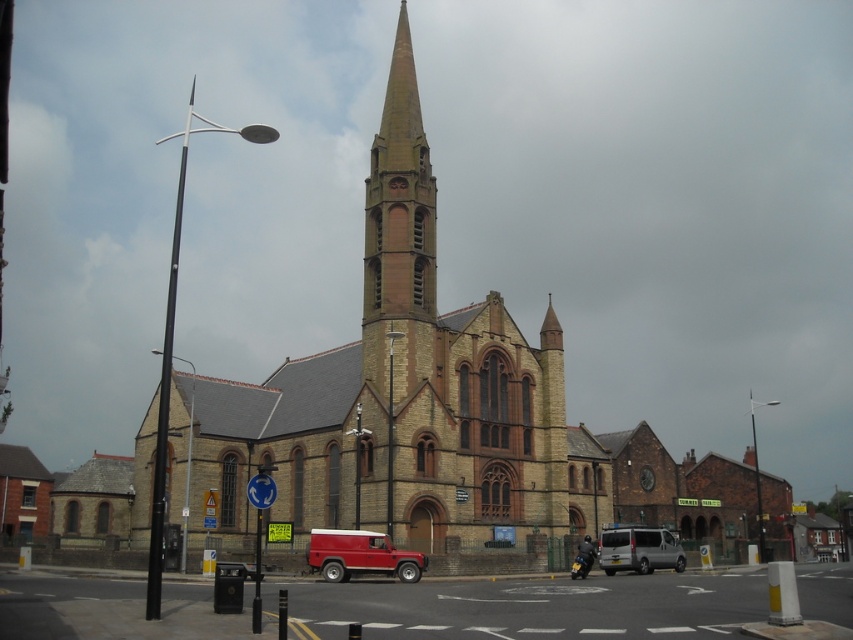
Question: Is brick church at center to the right of silver metallic van at center from the viewer's perspective?

Choices:
 (A) no
 (B) yes

Answer: (A)

Question: Observing the image, what is the correct spatial positioning of matte red van at center in reference to silver metallic van at center?

Choices:
 (A) below
 (B) above

Answer: (B)

Question: Among these points, which one is farthest from the camera?

Choices:
 (A) (334, 580)
 (B) (407, 260)

Answer: (B)

Question: Which point is closer to the camera?

Choices:
 (A) matte red van at center
 (B) brick church at center
 (C) silver metallic van at center
 (D) brown brick tower at center

Answer: (B)

Question: Which object appears farthest from the camera in this image?

Choices:
 (A) brick church at center
 (B) silver metallic van at center
 (C) brown brick tower at center
 (D) matte red van at center

Answer: (C)

Question: Is brick church at center below matte red van at center?

Choices:
 (A) no
 (B) yes

Answer: (A)